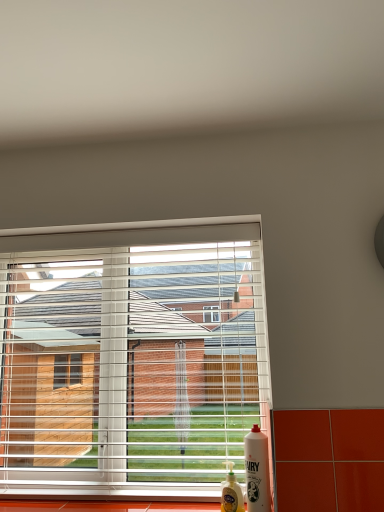
Question: Looking at their shapes, would you say white glossy fairy liquid at lower right, acting as the 1th bottle starting from the right, is wider or thinner than white plastic blinds at center?

Choices:
 (A) wide
 (B) thin

Answer: (B)

Question: Is point (251, 459) positioned closer to the camera than point (82, 390)?

Choices:
 (A) closer
 (B) farther

Answer: (A)

Question: Based on their relative distances, which object is farther from the translucent plastic bottle at lower right, which is the second bottle from right to left?

Choices:
 (A) white glossy fairy liquid at lower right, the second bottle viewed from the left
 (B) white plastic blinds at center

Answer: (B)

Question: Estimate the real-world distances between objects in this image. Which object is closer to the translucent plastic bottle at lower right, the first bottle from the left?

Choices:
 (A) white plastic blinds at center
 (B) white glossy fairy liquid at lower right, acting as the 1th bottle starting from the right

Answer: (B)